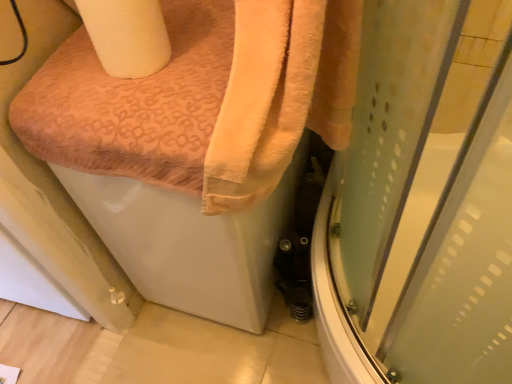
Question: Can you confirm if white matte toilet paper at upper left is smaller than orange soft towel at upper left?

Choices:
 (A) no
 (B) yes

Answer: (B)

Question: Is white matte toilet paper at upper left not within orange soft towel at upper left?

Choices:
 (A) yes
 (B) no

Answer: (A)

Question: Is white matte toilet paper at upper left to the right of orange soft towel at upper left from the viewer's perspective?

Choices:
 (A) no
 (B) yes

Answer: (A)

Question: Does white matte toilet paper at upper left come behind orange soft towel at upper left?

Choices:
 (A) no
 (B) yes

Answer: (B)

Question: Does white matte toilet paper at upper left have a greater height compared to orange soft towel at upper left?

Choices:
 (A) no
 (B) yes

Answer: (A)

Question: From a real-world perspective, does white matte toilet paper at upper left sit lower than orange soft towel at upper left?

Choices:
 (A) no
 (B) yes

Answer: (A)

Question: Is orange textured towel at upper left outside white matte toilet paper at upper left?

Choices:
 (A) yes
 (B) no

Answer: (A)

Question: Is orange textured towel at upper left wider than white matte toilet paper at upper left?

Choices:
 (A) yes
 (B) no

Answer: (A)

Question: Does orange textured towel at upper left have a greater height compared to white matte toilet paper at upper left?

Choices:
 (A) yes
 (B) no

Answer: (A)

Question: Would you consider orange textured towel at upper left to be distant from white matte toilet paper at upper left?

Choices:
 (A) no
 (B) yes

Answer: (A)

Question: Can you confirm if orange textured towel at upper left is shorter than white matte toilet paper at upper left?

Choices:
 (A) no
 (B) yes

Answer: (A)

Question: Does orange textured towel at upper left appear on the right side of white matte toilet paper at upper left?

Choices:
 (A) yes
 (B) no

Answer: (A)

Question: Are orange textured towel at upper left and transparent plastic screen door at lower right far apart?

Choices:
 (A) yes
 (B) no

Answer: (B)